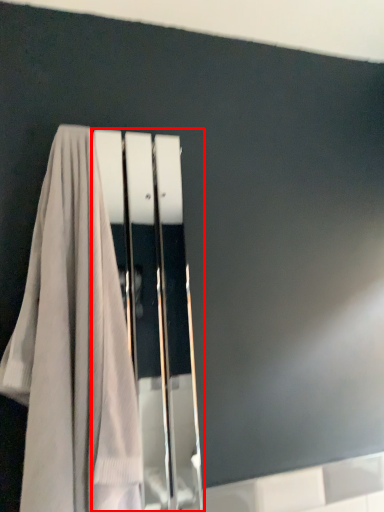
Question: Considering the relative positions of screen door (annotated by the red box) and towel in the image provided, where is screen door (annotated by the red box) located with respect to the staircase?

Choices:
 (A) left
 (B) right

Answer: (B)